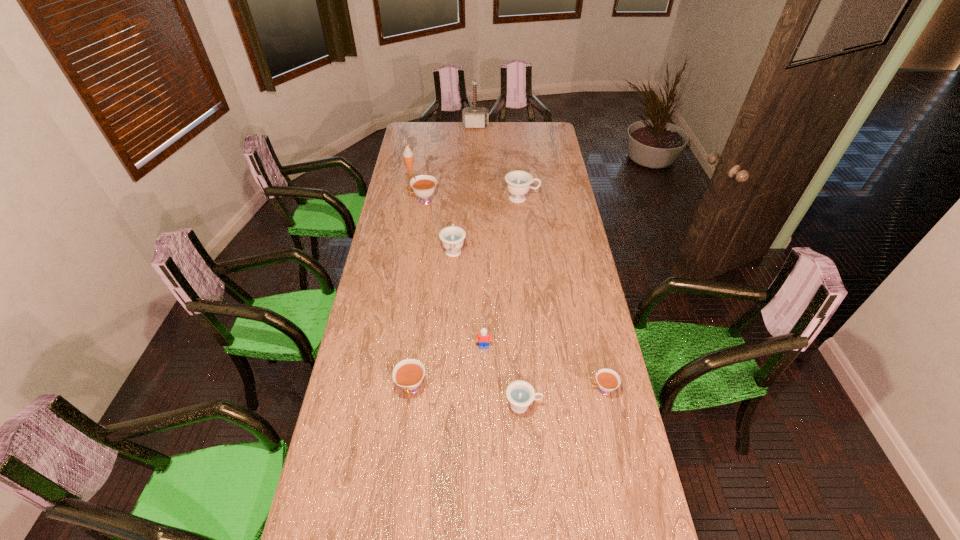
Where is `free space located 0.120m on the side of the fourth nearest teacup with the handle`? free space located 0.120m on the side of the fourth nearest teacup with the handle is located at coordinates (455, 221).

The height and width of the screenshot is (540, 960). In order to click on free region located on the face of the white Lego in this screenshot , I will do `click(485, 457)`.

Where is `blank space located 0.300m on the side of the second smallest white teacup with the handle`? blank space located 0.300m on the side of the second smallest white teacup with the handle is located at coordinates (397, 504).

The image size is (960, 540). I want to click on vacant area situated on the side of the nearest blue teacup with the handle, so click(582, 406).

Find the location of a particular element. vacant region located 0.270m on the side of the rightmost object with the handle is located at coordinates (509, 389).

Find the location of `vacant region located on the side of the rightmost object with the handle`. vacant region located on the side of the rightmost object with the handle is located at coordinates (517, 389).

Locate an element on the screen. vacant region located 0.240m on the side of the rightmost object with the handle is located at coordinates [x=517, y=389].

Image resolution: width=960 pixels, height=540 pixels. What are the coordinates of `object that is positioned at the far edge` in the screenshot? It's located at (472, 117).

Find the location of `icecream present at the left edge`. icecream present at the left edge is located at coordinates (408, 155).

You are a GUI agent. You are given a task and a screenshot of the screen. Output one action in this format:
    pyautogui.click(x=<x>, y=<y>)
    Task: Click on the teacup that is at the left edge
    
    Given the screenshot: What is the action you would take?
    (x=424, y=185)